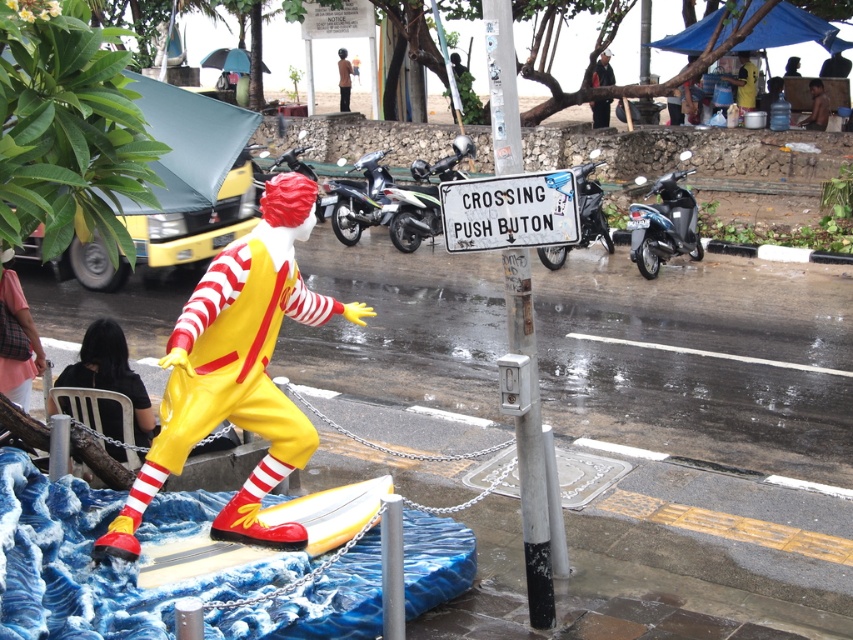
You are a delivery person who needs to park your white glossy motorcycle at center near the rusty metal pole at center. Since the pole is taller than the motorcycle, will the motorcycle fit under it without any issues?

The rusty metal pole at center is taller than the white glossy motorcycle at center, so the motorcycle can fit under it without any issues.

You are standing at the pedestrian crossing sign to the right of the statue. You need to press the button on the rusty metal pole at center to activate the walk signal. Can you reach the pole without crossing the street?

The rusty metal pole at center is located at point (529, 444), which is likely within reach from the pedestrian crossing area without needing to cross the street. Yes, you can reach it while staying on your side.